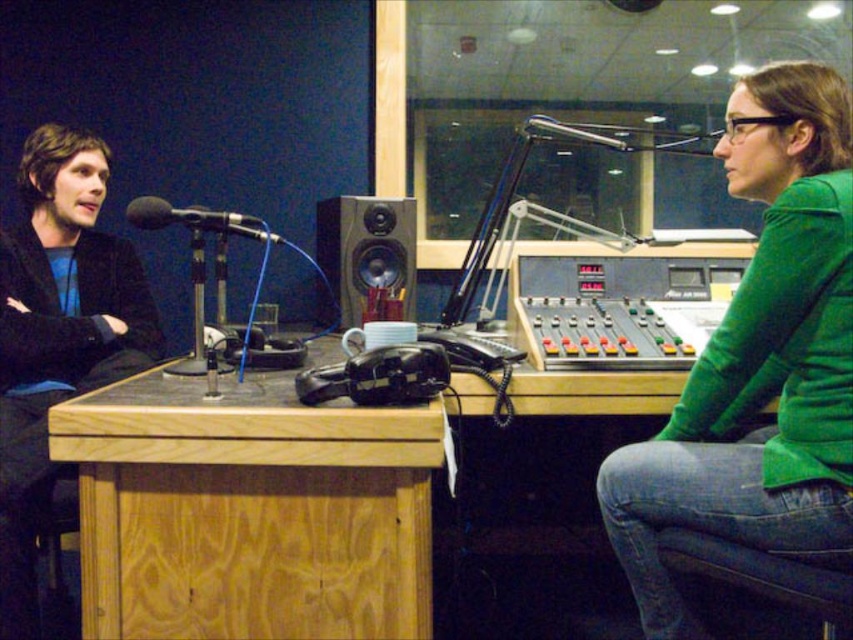
You are a technician in the studio and need to adjust the height of the green matte shirt at upper right and the black matte microphone at left. Which object requires a taller adjustment to match the other?

The green matte shirt at upper right is already taller than the black matte microphone at left, so the microphone would need to be raised to match the shirt.

You are a technician in the studio and need to adjust the height of the green matte shirt at upper right and the wooden speaker at center so that they are level with each other. Which object should you lower and which should you raise?

The green matte shirt at upper right is taller than wooden speaker at center. To make them level, you should lower the green matte shirt at upper right and raise the wooden speaker at center.

You are a technician entering the studio and need to adjust the green matte shirt at upper right and the black matte microphone at left. Which object should you reach for first based on their positions?

The green matte shirt at upper right is closer to the viewer than the black matte microphone at left, so you should reach for the green matte shirt at upper right first.